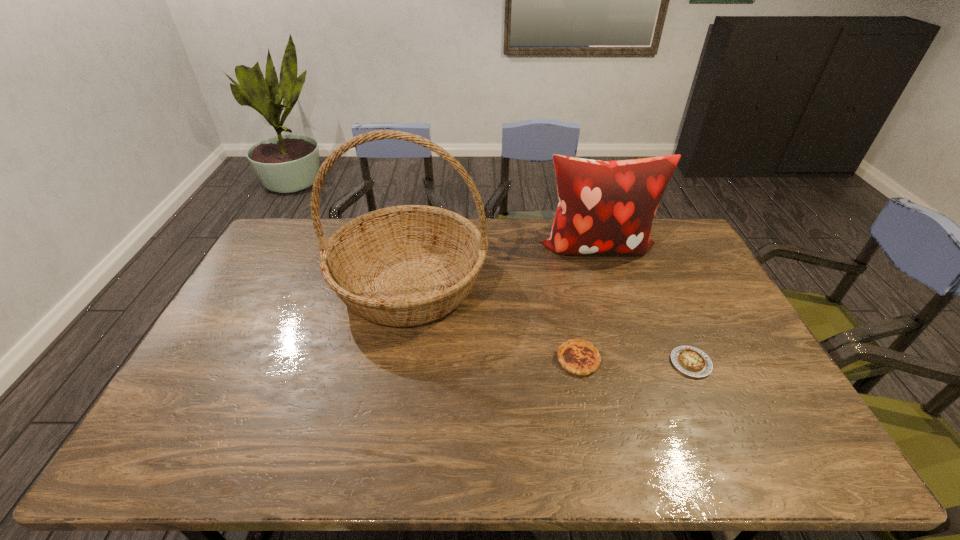
Where is `vacant area that lies between the left quiche and the tallest object`? This screenshot has width=960, height=540. vacant area that lies between the left quiche and the tallest object is located at coordinates (493, 321).

Identify which object is the nearest to the cushion. Please provide its 2D coordinates. Your answer should be formatted as a tuple, i.e. [(x, y)], where the tuple contains the x and y coordinates of a point satisfying the conditions above.

[(407, 265)]

At what (x,y) coordinates should I click in order to perform the action: click on object that stands as the closest to the leftmost object. Please return your answer as a coordinate pair (x, y). Looking at the image, I should click on (577, 356).

I want to click on vacant area in the image that satisfies the following two spatial constraints: 1. on the front-facing side of the second tallest object; 2. on the right side of the shorter quiche, so click(635, 363).

What are the coordinates of `vacant space that satisfies the following two spatial constraints: 1. on the front-facing side of the cushion; 2. on the right side of the shorter quiche` in the screenshot? It's located at (635, 363).